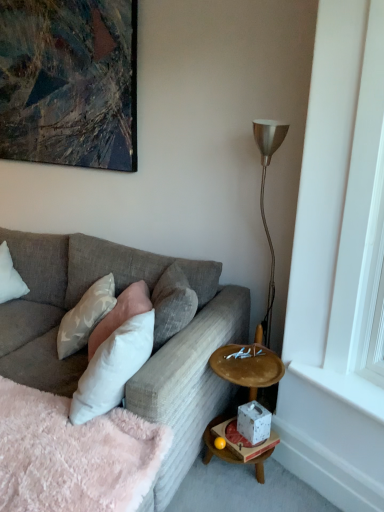
Question: Is white smooth window sill at lower right at the left side of white soft pillow at center, acting as the second pillow starting from the right?

Choices:
 (A) no
 (B) yes

Answer: (A)

Question: From the image's perspective, is white smooth window sill at lower right on white soft pillow at center, acting as the second pillow starting from the right?

Choices:
 (A) no
 (B) yes

Answer: (A)

Question: Is white smooth window sill at lower right facing away from white soft pillow at center, the second pillow viewed from the left?

Choices:
 (A) yes
 (B) no

Answer: (B)

Question: From a real-world perspective, is white smooth window sill at lower right over white soft pillow at center, the second pillow viewed from the left?

Choices:
 (A) yes
 (B) no

Answer: (B)

Question: Is white soft pillow at center, the second pillow viewed from the left, inside white smooth window sill at lower right?

Choices:
 (A) yes
 (B) no

Answer: (B)

Question: From a real-world perspective, is white smooth window sill at lower right physically below white soft pillow at center, the second pillow viewed from the left?

Choices:
 (A) no
 (B) yes

Answer: (B)

Question: Are fluffy pink blanket at lower left and white soft pillow at center, acting as the second pillow starting from the right, far apart?

Choices:
 (A) yes
 (B) no

Answer: (B)

Question: From the image's perspective, is fluffy pink blanket at lower left on white soft pillow at center, acting as the second pillow starting from the right?

Choices:
 (A) no
 (B) yes

Answer: (A)

Question: Could you tell me if fluffy pink blanket at lower left is turned towards white soft pillow at center, acting as the second pillow starting from the right?

Choices:
 (A) yes
 (B) no

Answer: (B)

Question: From the image's perspective, is fluffy pink blanket at lower left below white soft pillow at center, the second pillow viewed from the left?

Choices:
 (A) yes
 (B) no

Answer: (A)

Question: From a real-world perspective, is fluffy pink blanket at lower left beneath white soft pillow at center, acting as the second pillow starting from the right?

Choices:
 (A) yes
 (B) no

Answer: (A)

Question: Is fluffy pink blanket at lower left oriented away from white soft pillow at center, the second pillow viewed from the left?

Choices:
 (A) yes
 (B) no

Answer: (A)

Question: From the image's perspective, would you say metallic abstract painting at upper left is positioned over textured gray couch at center?

Choices:
 (A) yes
 (B) no

Answer: (A)